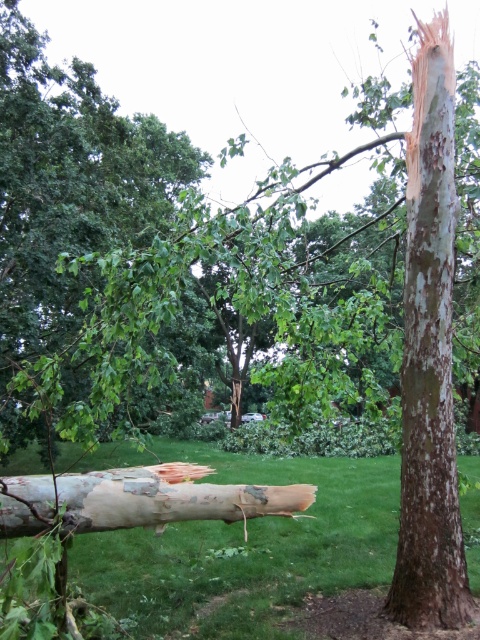
Which is below, smooth brown bark at right or white bark log at center?

white bark log at center

Looking at this image, who is more distant from viewer, (444, 196) or (72, 531)?

The point (444, 196) is more distant.

Does point (454, 524) lie in front of point (255, 513)?

That is True.

Where is `smooth brown bark at right`? This screenshot has height=640, width=480. smooth brown bark at right is located at coordinates (430, 356).

Between green grass at lower left and white bark log at center, which one appears on the left side from the viewer's perspective?

From the viewer's perspective, white bark log at center appears more on the left side.

Locate an element on the screen. green grass at lower left is located at coordinates (247, 548).

This screenshot has height=640, width=480. Identify the location of green grass at lower left. (247, 548).

Is green grass at lower left positioned at the back of smooth brown bark at right?

That is True.

The width and height of the screenshot is (480, 640). In order to click on green grass at lower left in this screenshot , I will do click(x=247, y=548).

Is point (240, 579) positioned in front of point (421, 100)?

That is False.

You are a GUI agent. You are given a task and a screenshot of the screen. Output one action in this format:
    pyautogui.click(x=<x>, y=<y>)
    Task: Click on the green grass at lower left
    This screenshot has width=480, height=640.
    Given the screenshot: What is the action you would take?
    pyautogui.click(x=247, y=548)